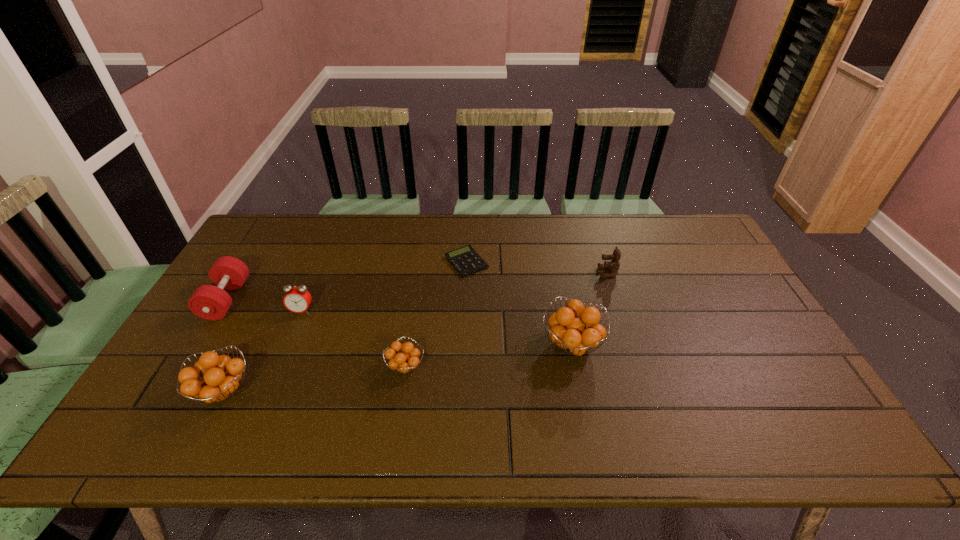
Locate an element on the screen. vacant area situated 0.270m on the back of the sixth object from right to left is located at coordinates (272, 294).

You are a GUI agent. You are given a task and a screenshot of the screen. Output one action in this format:
    pyautogui.click(x=<x>, y=<y>)
    Task: Click on the free spot located 0.120m on the back of the shortest orange fruit
    The height and width of the screenshot is (540, 960).
    Given the screenshot: What is the action you would take?
    pyautogui.click(x=414, y=318)

Locate an element on the screen. The width and height of the screenshot is (960, 540). free space located on the right of the second object from right to left is located at coordinates tap(718, 345).

The width and height of the screenshot is (960, 540). I want to click on vacant space located on the front of the third object from right to left, so click(464, 354).

Find the location of a particular element. vacant region located on the face of the rightmost object is located at coordinates (x=555, y=273).

What are the coordinates of `free space located 0.400m on the face of the rightmost object` in the screenshot? It's located at (473, 273).

Find the location of `free space located on the face of the rightmost object`. free space located on the face of the rightmost object is located at coordinates (499, 273).

Where is `vacant region located on the right of the dumbbell`? The image size is (960, 540). vacant region located on the right of the dumbbell is located at coordinates (340, 300).

Find the location of `vacant space located 0.060m on the front-facing side of the alarm clock`. vacant space located 0.060m on the front-facing side of the alarm clock is located at coordinates (293, 332).

Where is `object at the far edge`? Image resolution: width=960 pixels, height=540 pixels. object at the far edge is located at coordinates (465, 260).